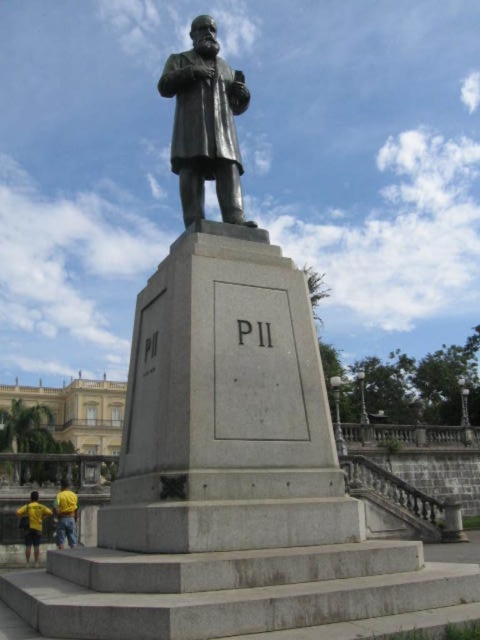
You are an art conservator assessing the space around the bronze statue at center and the yellow fabric at lower left. Which object occupies more horizontal space in the image?

The bronze statue at center has a larger width than the yellow fabric at lower left, so it occupies more horizontal space in the image.